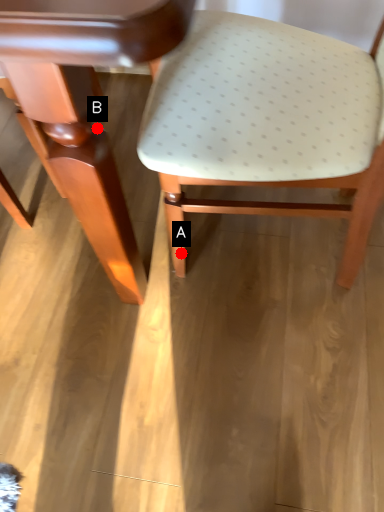
Question: Two points are circled on the image, labeled by A and B beside each circle. Which point is closer to the camera?

Choices:
 (A) A is closer
 (B) B is closer

Answer: (B)